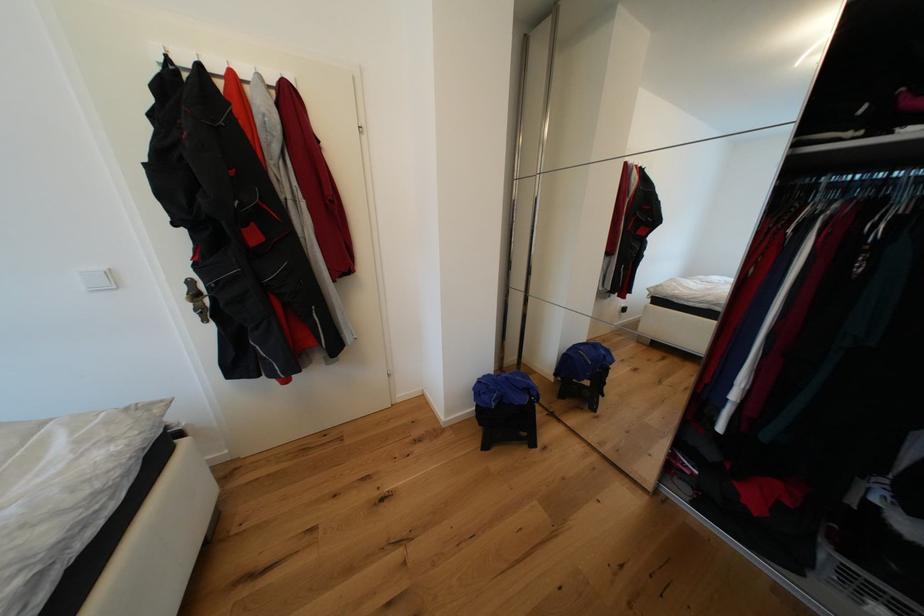
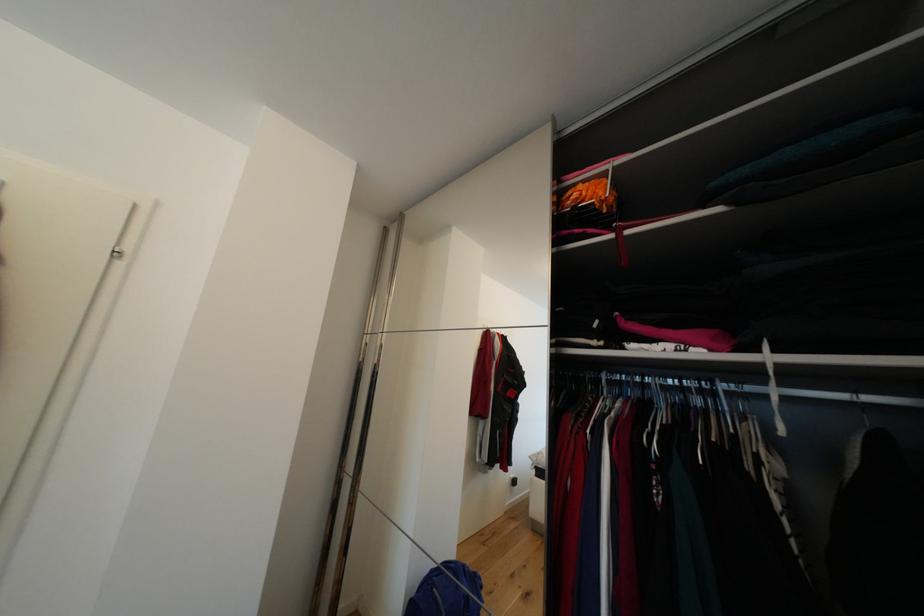
Where in the second image is the point corresponding to point (573, 354) from the first image?

(421, 592)